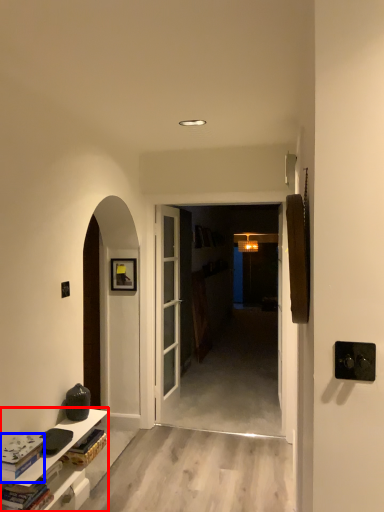
Question: Among these objects, which one is nearest to the camera, cabinetry (highlighted by a red box) or book (highlighted by a blue box)?

Choices:
 (A) cabinetry
 (B) book

Answer: (B)